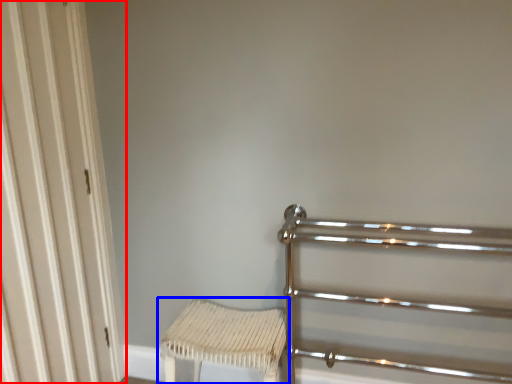
Question: Among these objects, which one is nearest to the camera, door (highlighted by a red box) or furniture (highlighted by a blue box)?

Choices:
 (A) door
 (B) furniture

Answer: (A)